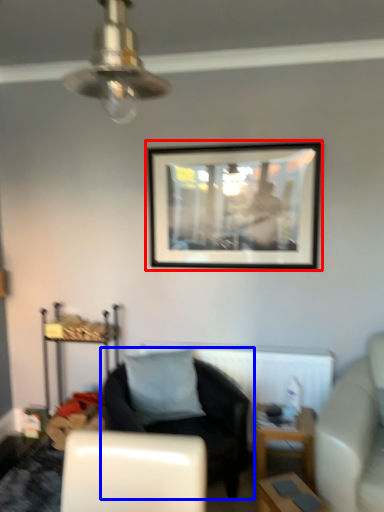
Question: Which point is further to the camera, picture frame (highlighted by a red box) or chair (highlighted by a blue box)?

Choices:
 (A) picture frame
 (B) chair

Answer: (A)